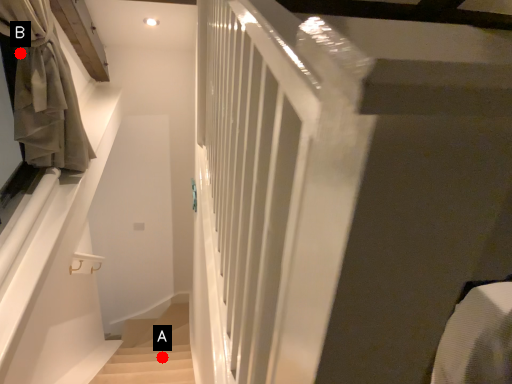
Question: Two points are circled on the image, labeled by A and B beside each circle. Which point is further to the camera?

Choices:
 (A) A is further
 (B) B is further

Answer: (A)